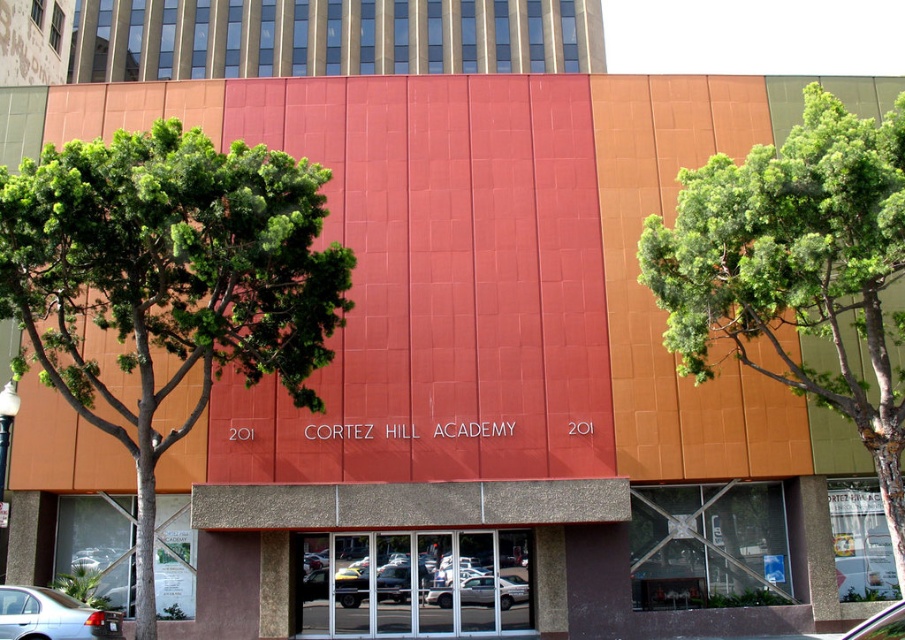
You are standing at the entrance of Cortez Hill Academy and want to park your silver metallic sedan at lower left. The parking lot has a restricted area marked by a red line at point (52, 616). Can you safely park your car there without crossing the red line?

The silver metallic sedan at lower left is located at point (52, 616), which is exactly where the restricted area is marked by the red line. Therefore, you cannot park there as it would violate the parking restrictions.

You are a delivery driver who needs to park your truck, which is 2 meters wide, in the parking lot near Cortez Hill Academy. There are two parking spots available. One is next to the silver metallic sedan at lower left, and the other is next to the silver metallic sedan at center. Which parking spot will allow your truck to fit without overlapping the sedans?

The parking spot next to the silver metallic sedan at lower left is better because it has a lesser width compared to the silver metallic sedan at center. Since your truck is 2 meters wide, it can fit better next to the narrower sedan at lower left without overlapping.